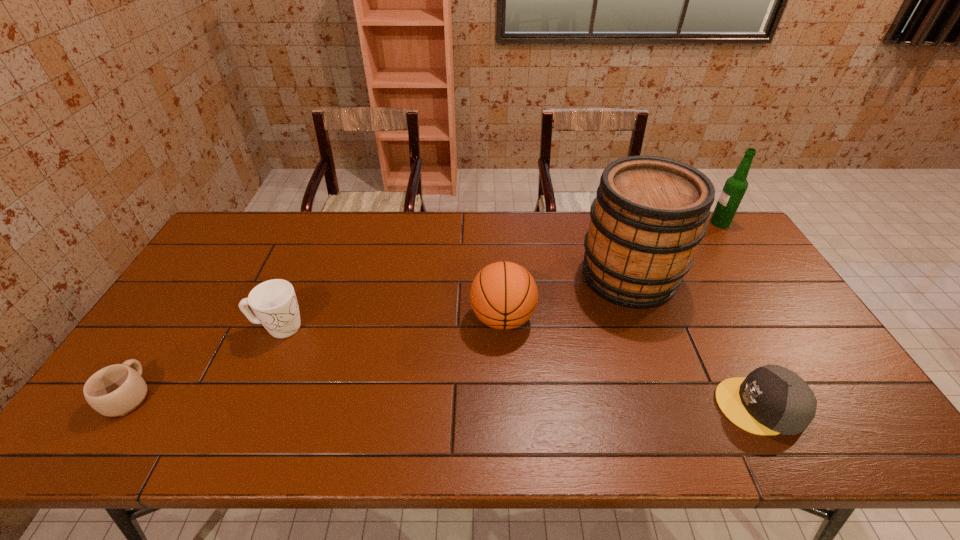
I want to click on the tallest object, so click(649, 215).

Locate an element on the screen. The height and width of the screenshot is (540, 960). the fifth shortest object is located at coordinates (735, 186).

You are a GUI agent. You are given a task and a screenshot of the screen. Output one action in this format:
    pyautogui.click(x=<x>, y=<y>)
    Task: Click on the farthest object
    This screenshot has height=540, width=960.
    Given the screenshot: What is the action you would take?
    pyautogui.click(x=735, y=186)

At what (x,y) coordinates should I click in order to perform the action: click on basketball. Please return your answer as a coordinate pair (x, y). This screenshot has height=540, width=960. Looking at the image, I should click on (503, 295).

Locate an element on the screen. Image resolution: width=960 pixels, height=540 pixels. the fourth object from right to left is located at coordinates (503, 295).

At what (x,y) coordinates should I click in order to perform the action: click on the taller mug. Please return your answer as a coordinate pair (x, y). The image size is (960, 540). Looking at the image, I should click on (274, 302).

Where is `the farther mug`? the farther mug is located at coordinates (274, 302).

Image resolution: width=960 pixels, height=540 pixels. I want to click on cap, so click(x=771, y=400).

Where is `the shorter mug`? the shorter mug is located at coordinates pos(118,390).

At what (x,y) coordinates should I click in order to perform the action: click on the left mug. Please return your answer as a coordinate pair (x, y). The height and width of the screenshot is (540, 960). Looking at the image, I should click on (118, 390).